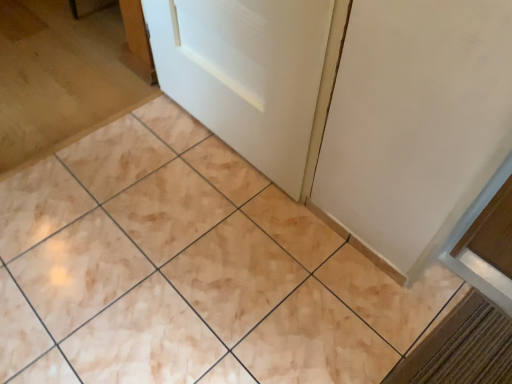
Question: Is the position of white glossy door at upper center less distant than that of beige marble tile at center?

Choices:
 (A) yes
 (B) no

Answer: (B)

Question: Is white glossy door at upper center outside beige marble tile at center?

Choices:
 (A) no
 (B) yes

Answer: (B)

Question: Can you confirm if white glossy door at upper center is shorter than beige marble tile at center?

Choices:
 (A) yes
 (B) no

Answer: (B)

Question: From a real-world perspective, is white glossy door at upper center over beige marble tile at center?

Choices:
 (A) yes
 (B) no

Answer: (A)

Question: From the image's perspective, would you say white glossy door at upper center is positioned over beige marble tile at center?

Choices:
 (A) yes
 (B) no

Answer: (A)

Question: Is white glossy door at upper center positioned with its back to beige marble tile at center?

Choices:
 (A) no
 (B) yes

Answer: (A)

Question: Does beige marble tile at center touch white glossy door at upper center?

Choices:
 (A) yes
 (B) no

Answer: (B)

Question: Is beige marble tile at center shorter than white glossy door at upper center?

Choices:
 (A) no
 (B) yes

Answer: (B)

Question: From the image's perspective, is beige marble tile at center below white glossy door at upper center?

Choices:
 (A) yes
 (B) no

Answer: (A)

Question: Does beige marble tile at center have a larger size compared to white glossy door at upper center?

Choices:
 (A) yes
 (B) no

Answer: (A)

Question: Considering the relative sizes of beige marble tile at center and white glossy door at upper center in the image provided, is beige marble tile at center wider than white glossy door at upper center?

Choices:
 (A) no
 (B) yes

Answer: (B)

Question: From the image's perspective, is beige marble tile at center on top of white glossy door at upper center?

Choices:
 (A) yes
 (B) no

Answer: (B)

Question: From a real-world perspective, is white glossy door at upper center positioned above or below beige marble tile at center?

Choices:
 (A) below
 (B) above

Answer: (B)